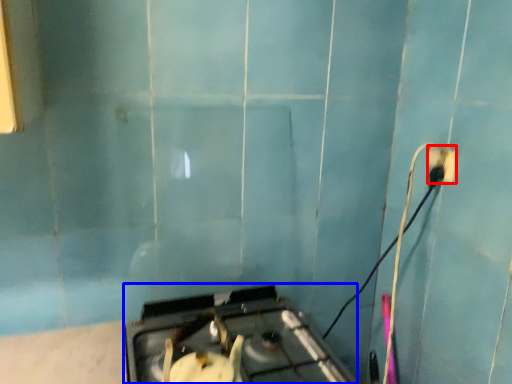
Question: Which object appears farthest to the camera in this image, power plugs and sockets (highlighted by a red box) or gas stove (highlighted by a blue box)?

Choices:
 (A) power plugs and sockets
 (B) gas stove

Answer: (A)